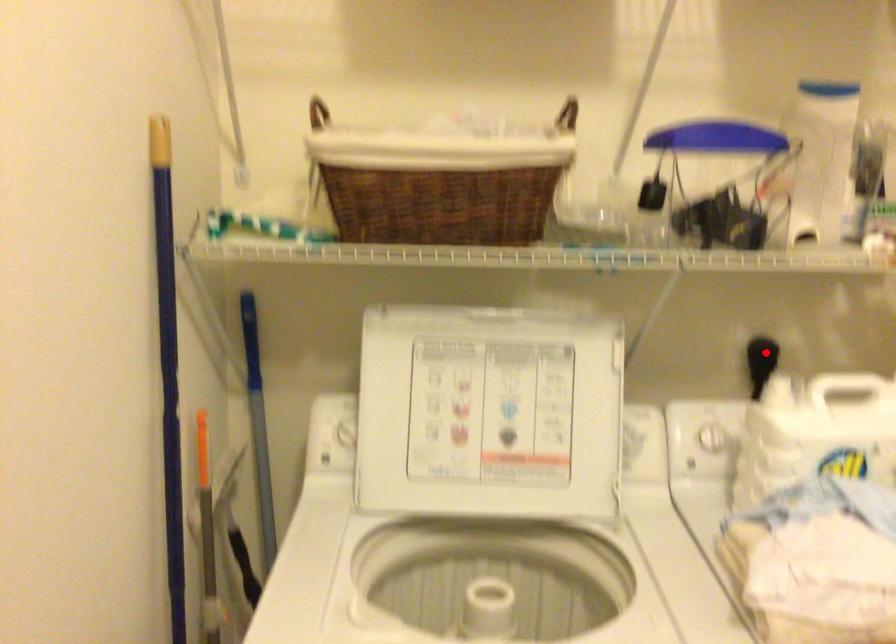
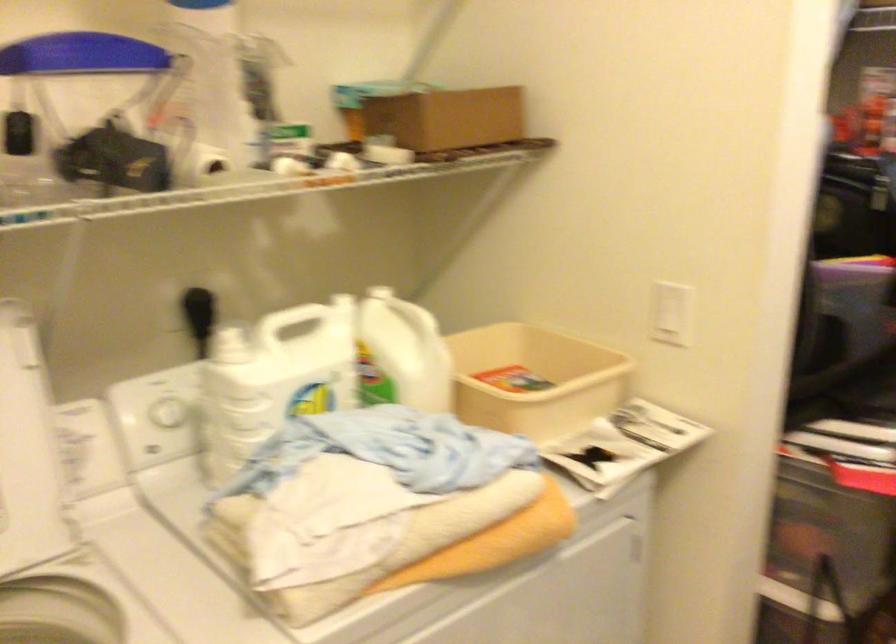
Where in the second image is the point corresponding to the highlighted location from the first image?

(197, 303)